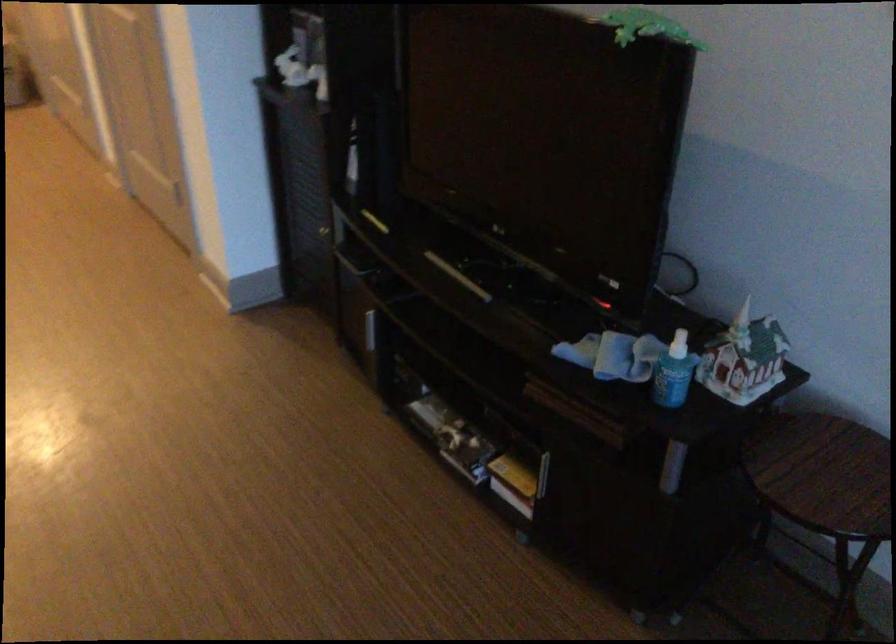
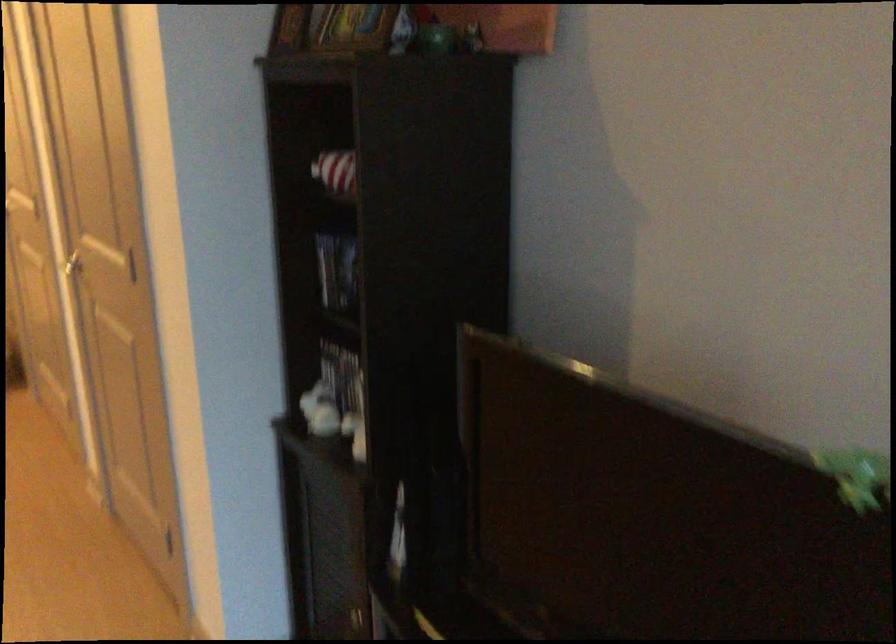
Which direction would the cameraman need to move to produce the second image?

The movement direction of the cameraman is left, forward.